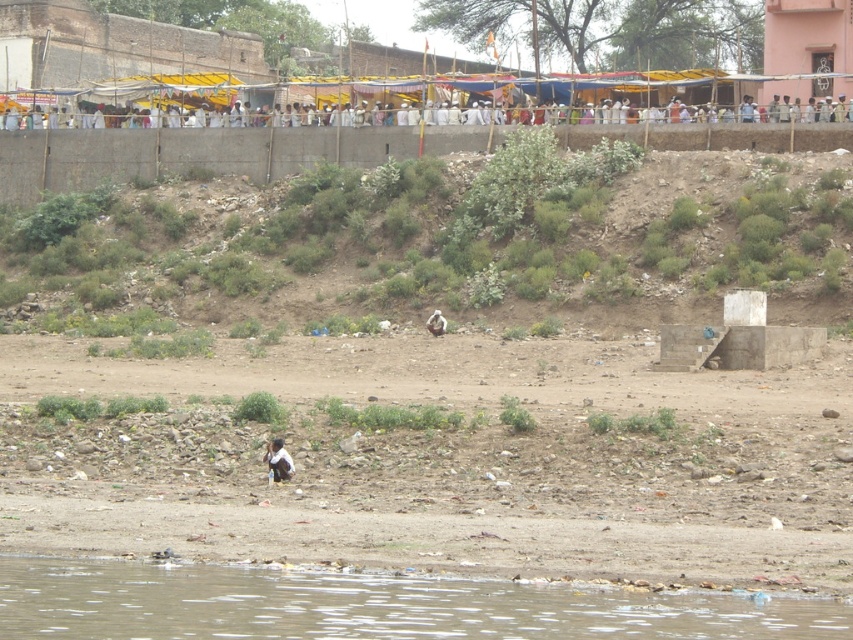
You are standing at the point labeled as point (x=373, y=604) in the image. What is the nearest object to you in the scene?

The nearest object to you at point (x=373, y=604) is the brown sedimentary river at lower left.